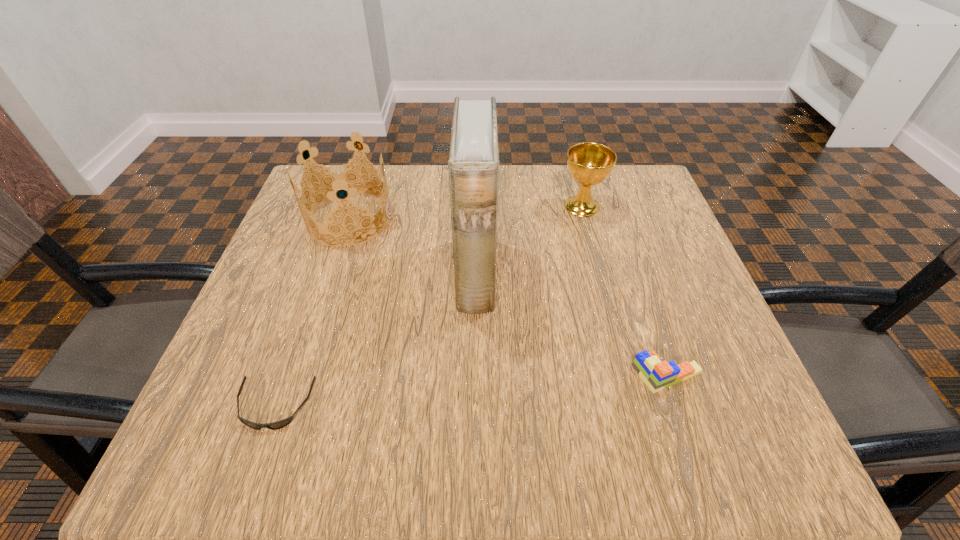
You are a GUI agent. You are given a task and a screenshot of the screen. Output one action in this format:
    pyautogui.click(x=<x>, y=<y>)
    Task: Click on the vacant space at the far edge
    Image resolution: width=960 pixels, height=540 pixels.
    Given the screenshot: What is the action you would take?
    pyautogui.click(x=412, y=215)

In the image, there is a desktop. Where is `vacant space at the near edge`? vacant space at the near edge is located at coordinates (433, 448).

Identify the location of free space at the left edge. The width and height of the screenshot is (960, 540). (311, 363).

The height and width of the screenshot is (540, 960). In the image, there is a desktop. In order to click on free space at the right edge in this screenshot , I will do `click(615, 228)`.

Find the location of a particular element. The height and width of the screenshot is (540, 960). vacant area at the far right corner is located at coordinates (615, 220).

The image size is (960, 540). In order to click on vacant space that's between the second shortest object and the third object from right to left in this screenshot , I will do `click(571, 325)`.

The image size is (960, 540). Identify the location of free spot between the tallest object and the shortest object. (375, 340).

This screenshot has width=960, height=540. Identify the location of free spot between the chalice and the sunglasses. (428, 306).

Find the location of a particular element. Image resolution: width=960 pixels, height=540 pixels. vacant area between the tallest object and the sunglasses is located at coordinates (375, 340).

Image resolution: width=960 pixels, height=540 pixels. I want to click on free spot between the phonebook and the chalice, so click(529, 240).